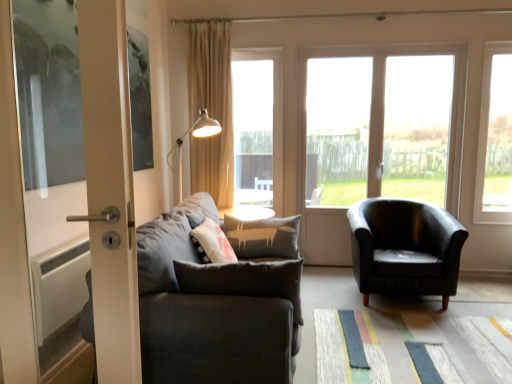
Question: Considering the relative sizes of dark gray fabric couch at left and transparent glass window at right, the fourth window viewed from the left, in the image provided, is dark gray fabric couch at left wider than transparent glass window at right, the fourth window viewed from the left,?

Choices:
 (A) yes
 (B) no

Answer: (A)

Question: Considering the relative sizes of dark gray fabric couch at left and transparent glass window at right, which is the 1th window in right-to-left order, in the image provided, is dark gray fabric couch at left bigger than transparent glass window at right, which is the 1th window in right-to-left order,?

Choices:
 (A) yes
 (B) no

Answer: (A)

Question: Is dark gray fabric couch at left positioned in front of transparent glass window at right, which is the 1th window in right-to-left order?

Choices:
 (A) yes
 (B) no

Answer: (A)

Question: Is dark gray fabric couch at left to the left of transparent glass window at right, which is the 1th window in right-to-left order, from the viewer's perspective?

Choices:
 (A) yes
 (B) no

Answer: (A)

Question: Considering the relative sizes of dark gray fabric couch at left and transparent glass window at right, the fourth window viewed from the left, in the image provided, is dark gray fabric couch at left smaller than transparent glass window at right, the fourth window viewed from the left,?

Choices:
 (A) no
 (B) yes

Answer: (A)

Question: Considering the positions of point (202, 347) and point (410, 89), is point (202, 347) closer or farther from the camera than point (410, 89)?

Choices:
 (A) closer
 (B) farther

Answer: (A)

Question: Would you say dark gray fabric couch at left is inside or outside transparent glass window at center?

Choices:
 (A) outside
 (B) inside

Answer: (A)

Question: Is dark gray fabric couch at left bigger or smaller than transparent glass window at center?

Choices:
 (A) small
 (B) big

Answer: (B)

Question: Considering the relative positions of dark gray fabric couch at left and transparent glass window at center in the image provided, is dark gray fabric couch at left to the left or to the right of transparent glass window at center?

Choices:
 (A) right
 (B) left

Answer: (B)

Question: Looking at the image, does transparent glass window at center, the 1th window viewed from the left, seem bigger or smaller compared to dark gray fabric couch at left?

Choices:
 (A) small
 (B) big

Answer: (A)

Question: Is transparent glass window at center, the 1th window viewed from the left, wider or thinner than dark gray fabric couch at left?

Choices:
 (A) thin
 (B) wide

Answer: (A)

Question: From the image's perspective, relative to dark gray fabric couch at left, is transparent glass window at center, the 1th window viewed from the left, above or below?

Choices:
 (A) below
 (B) above

Answer: (B)

Question: Relative to dark gray fabric couch at left, is transparent glass window at center, the 1th window viewed from the left, in front or behind?

Choices:
 (A) front
 (B) behind

Answer: (B)

Question: In terms of height, does transparent glass window at center, which is counted as the 4th window, starting from the right, look taller or shorter compared to beige fabric curtain at upper center?

Choices:
 (A) tall
 (B) short

Answer: (B)

Question: Based on their sizes in the image, would you say transparent glass window at center, which is counted as the 4th window, starting from the right, is bigger or smaller than beige fabric curtain at upper center?

Choices:
 (A) small
 (B) big

Answer: (A)